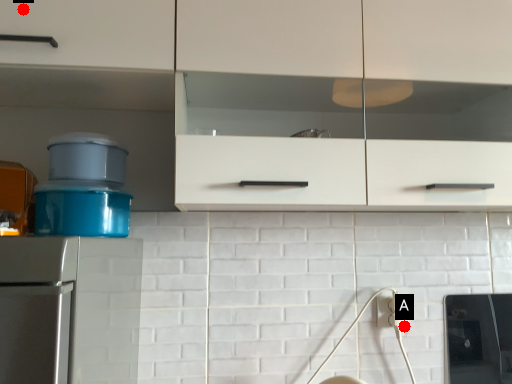
Question: Two points are circled on the image, labeled by A and B beside each circle. Which of the following is the farthest from the observer?

Choices:
 (A) A is further
 (B) B is further

Answer: (A)